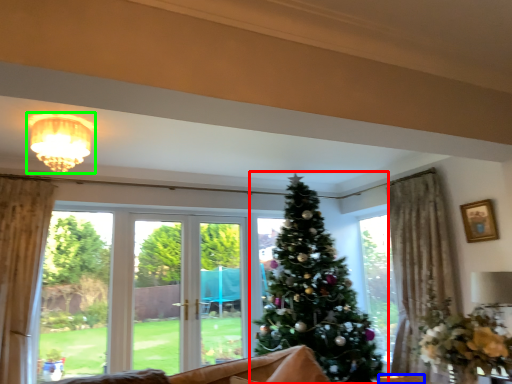
Question: Based on their relative distances, which object is nearer to christmas tree (highlighted by a red box)? Choose from furniture (highlighted by a blue box) and light fixture (highlighted by a green box).

Choices:
 (A) furniture
 (B) light fixture

Answer: (A)